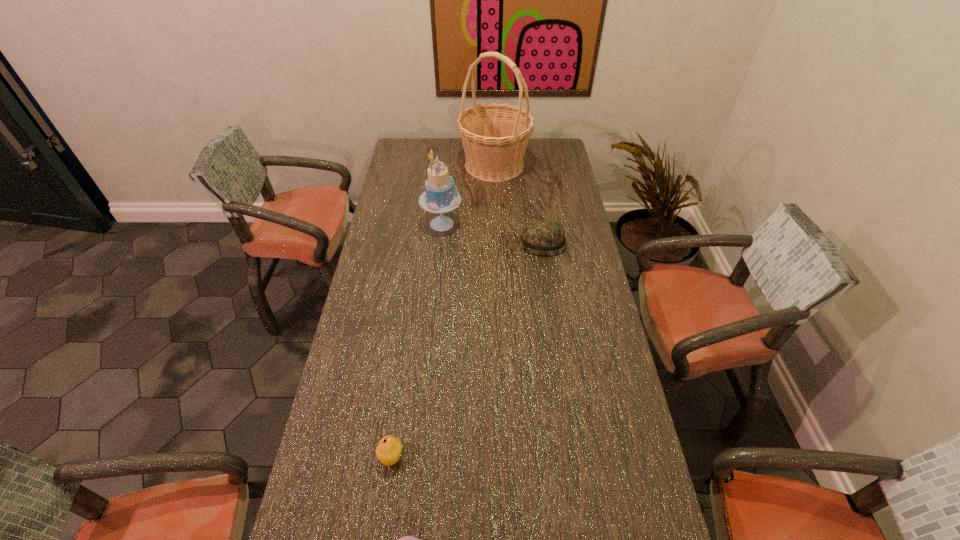
At what (x,y) coordinates should I click in order to perform the action: click on object present at the left edge. Please return your answer as a coordinate pair (x, y). Looking at the image, I should click on (388, 452).

Where is `object present at the right edge`? Image resolution: width=960 pixels, height=540 pixels. object present at the right edge is located at coordinates (540, 237).

In the image, there is a desktop. What are the coordinates of `blank space at the left edge` in the screenshot? It's located at pyautogui.click(x=381, y=337).

This screenshot has width=960, height=540. Identify the location of blank space at the right edge of the desktop. (558, 170).

Identify the location of empty space that is in between the second nearest object and the cake. The width and height of the screenshot is (960, 540). (417, 340).

I want to click on vacant space that is in between the headwear and the tallest object, so click(518, 204).

I want to click on vacant area between the headwear and the second nearest object, so click(467, 350).

The image size is (960, 540). Find the location of `free spot between the cake and the fourth farthest object`. free spot between the cake and the fourth farthest object is located at coordinates (417, 340).

At what (x,y) coordinates should I click in order to perform the action: click on empty space that is in between the headwear and the second tallest object. Please return your answer as a coordinate pair (x, y). The image size is (960, 540). Looking at the image, I should click on (492, 233).

At what (x,y) coordinates should I click in order to perform the action: click on object that is the third nearest to the doughnut. Please return your answer as a coordinate pair (x, y). The height and width of the screenshot is (540, 960). Looking at the image, I should click on (440, 196).